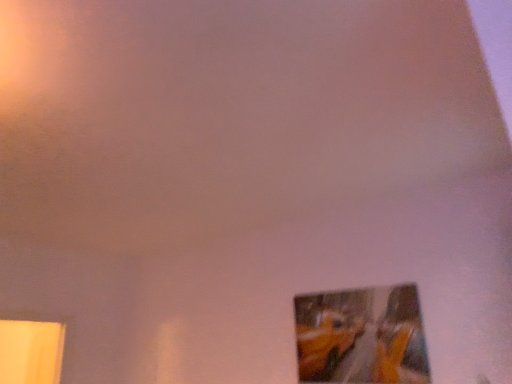
Image resolution: width=512 pixels, height=384 pixels. Identify the location of matte yellow picture frame at lower right. (361, 337).

What do you see at coordinates (361, 337) in the screenshot? I see `matte yellow picture frame at lower right` at bounding box center [361, 337].

Find the location of a particular element. matte yellow picture frame at lower right is located at coordinates (361, 337).